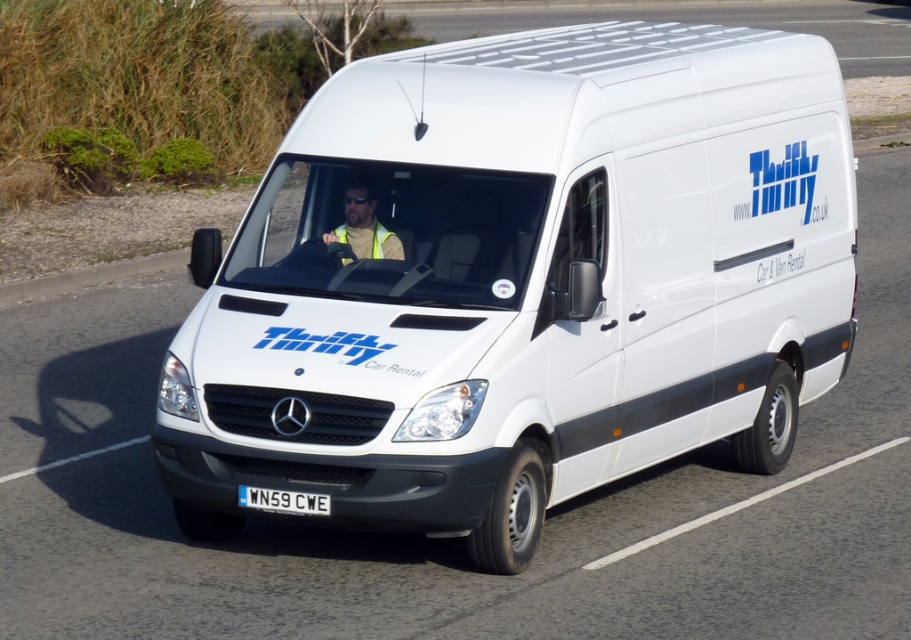
You are a delivery driver who needs to check if your high visibility vest is properly visible from the side window. Based on the scene, is the yellow reflective vest at center taller than the white plastic license plate at center?

The yellow reflective vest at center has a greater height compared to the white plastic license plate at center, so yes, the vest is taller and should be visible from the side window.

You are a delivery driver who needs to park your white matte van at center in a specific spot. The parking spot is located at coordinate point 0.441, 0.574. Can you confirm if your van is already positioned correctly?

Yes, the white matte van at center is already positioned correctly at coordinate point (521,282).

You are a delivery driver who needs to attach a GPS tracker to the license plate of the white matte van at center. The GPS tracker requires a minimum of 5 feet of clearance from the van to function properly. Can you safely attach the tracker to the white plastic license plate at center without violating the clearance requirement?

The distance between the white matte van at center and the white plastic license plate at center is 6.36 feet, which exceeds the required 5 feet clearance. Therefore, you can safely attach the GPS tracker to the license plate without violating the clearance requirement.